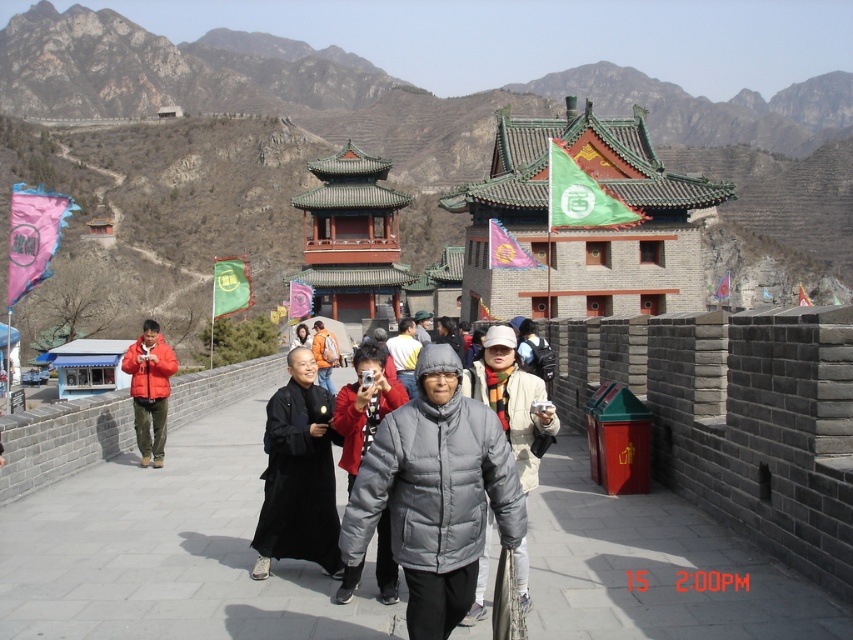
Question: Among these points, which one is nearest to the camera?

Choices:
 (A) (413, 380)
 (B) (843, 204)

Answer: (A)

Question: Can you confirm if gray woolen jacket at center is smaller than matte black jacket at center?

Choices:
 (A) yes
 (B) no

Answer: (A)

Question: Which point is closer to the camera?

Choices:
 (A) matte gray coat at center
 (B) gray down jacket at center
 (C) orange fabric jacket at center

Answer: (B)

Question: Which point is closer to the camera?

Choices:
 (A) gray down jacket at center
 (B) black matte robe at center

Answer: (A)

Question: Can you confirm if matte gray coat at center is positioned below orange fabric jacket at center?

Choices:
 (A) no
 (B) yes

Answer: (B)

Question: Does gray puffy jacket at center have a greater width compared to matte gray coat at center?

Choices:
 (A) yes
 (B) no

Answer: (A)